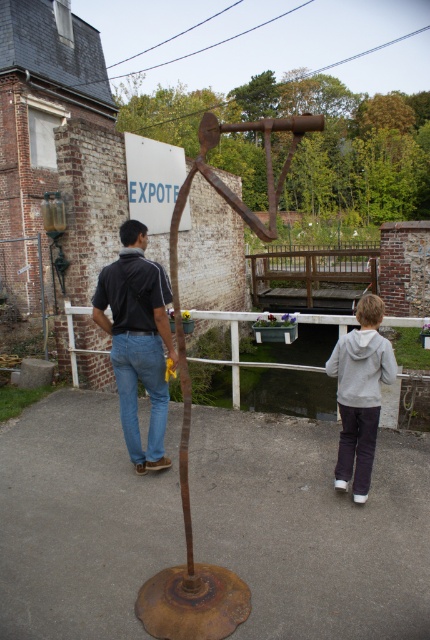
You are a photographer trying to capture a photo of the gray fleece jacket at lower center without the white wooden rail at center appearing in the frame. Based on their positions, is this possible?

The gray fleece jacket at lower center is positioned under the white wooden rail at center. To avoid the rail in the photo, you could lower your camera angle so the rail is above the jacket and out of the frame.

You are a visitor at an art exhibition and want to take a photo of the rusty metal sculpture at center without the brown wooden rail at center appearing in the frame. Since the sculpture is larger than the rail, how can you position yourself to exclude the rail from your photo?

Since the rusty metal sculpture at center is larger than the brown wooden rail at center, you can position yourself closer to the sculpture so that it fills the frame, thereby blocking the view of the rail. Alternatively, you can move to the side of the sculpture where the rail is not visible, ensuring that the larger sculpture obscures the rail from the camera angle.